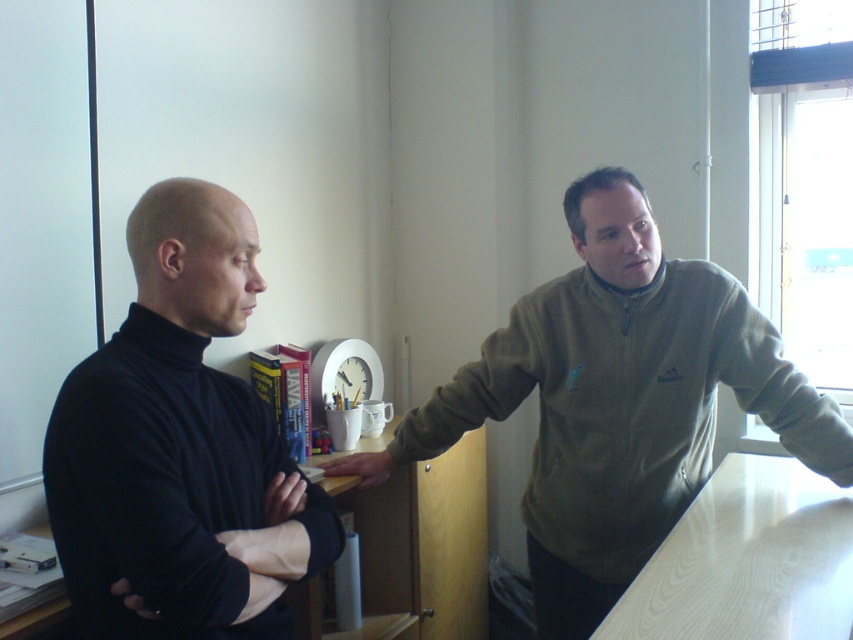
Between black turtleneck sweater at left and matte black hand at center, which one appears on the right side from the viewer's perspective?

From the viewer's perspective, matte black hand at center appears more on the right side.

Can you confirm if black turtleneck sweater at left is positioned to the left of matte black hand at center?

Yes, black turtleneck sweater at left is to the left of matte black hand at center.

I want to click on black turtleneck sweater at left, so click(x=178, y=445).

Identify the location of black turtleneck sweater at left. This screenshot has width=853, height=640. (178, 445).

Between point (828, 428) and point (300, 502), which one is positioned in front?

Point (300, 502) is more forward.

Which of these two, olive-green fleece at right or matte black hand at center, stands taller?

olive-green fleece at right is taller.

Locate an element on the screen. The height and width of the screenshot is (640, 853). olive-green fleece at right is located at coordinates (622, 400).

Between point (303, 499) and point (135, 608), which one is positioned in front?

Point (135, 608) is in front.

In the scene shown: Who is positioned more to the right, matte black hand at center or black matte hand at lower left?

Positioned to the right is matte black hand at center.

Image resolution: width=853 pixels, height=640 pixels. Describe the element at coordinates (283, 497) in the screenshot. I see `matte black hand at center` at that location.

Locate an element on the screen. This screenshot has height=640, width=853. matte black hand at center is located at coordinates (283, 497).